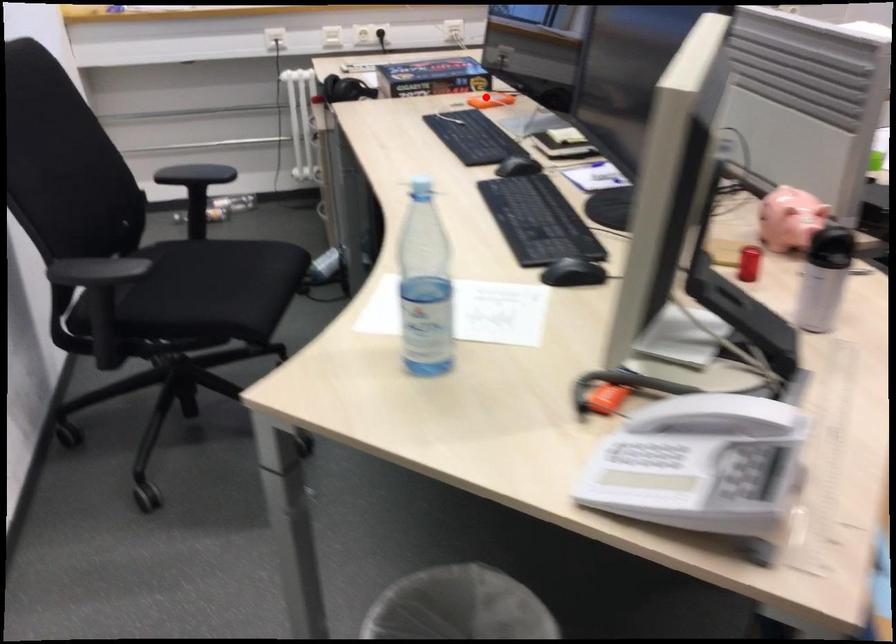
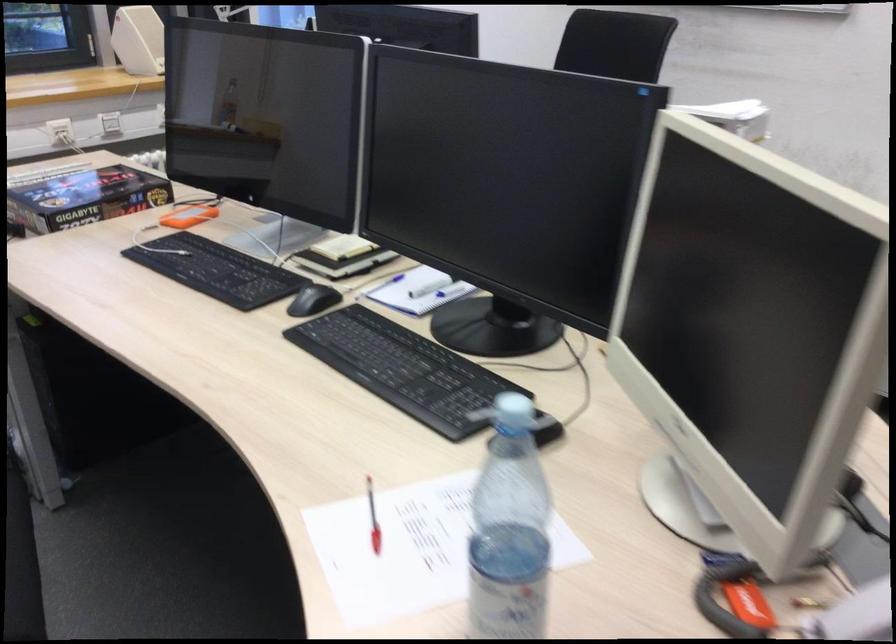
Question: I am providing you with two images of the same scene from different viewpoints. Image1 has a red point marked. In image2, the corresponding 3D location appears at what relative position? Reply with the corresponding letter.

Choices:
 (A) Closer
 (B) Farther

Answer: (A)